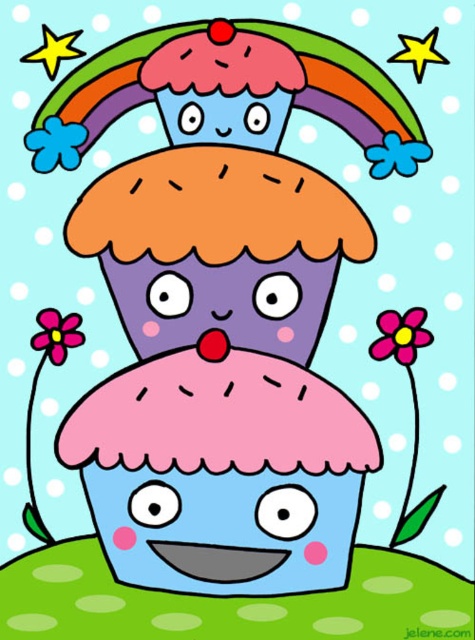
You are a bee that wants to collect nectar from both the pink fabric flower at upper right and the blue matte flower at upper left. Given that your flight range is 12 inches, can you visit both flowers without exceeding your range?

The pink fabric flower at upper right and the blue matte flower at upper left are 11.20 inches apart from each other. Since your flight range is 12 inches, you can visit both flowers without exceeding your range as the distance between them is within your flight capability.

You are a gardener who wants to plant two flowers in a garden. You have a blue matte flower at upper left and a pink matte flower at lower left. The garden has a path that is 5 inches wide. Can you place both flowers on either side of the path without them overlapping?

The blue matte flower at upper left is 5.02 inches from the pink matte flower at lower left. Since the path is 5 inches wide, the distance between them is slightly more than the path width, so they can be placed on either side without overlapping.